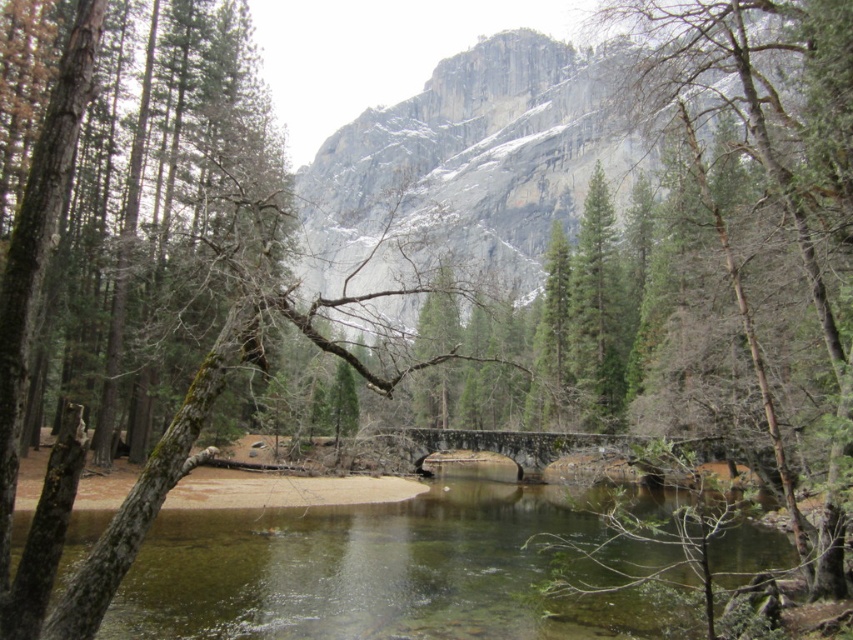
Question: Which point appears closest to the camera in this image?

Choices:
 (A) (315, 340)
 (B) (506, 508)
 (C) (461, 445)

Answer: (A)

Question: Based on their relative distances, which object is nearer to the green matte tree at center?

Choices:
 (A) gray rock mountain at upper center
 (B) green mossy tree trunk at center
 (C) clear water at center

Answer: (B)

Question: Does stone bridge at center have a smaller size compared to green mossy tree trunk at center?

Choices:
 (A) no
 (B) yes

Answer: (B)

Question: Does clear water at center appear on the left side of green matte tree at center?

Choices:
 (A) yes
 (B) no

Answer: (A)

Question: Does green matte tree at center come behind green mossy tree trunk at center?

Choices:
 (A) yes
 (B) no

Answer: (A)

Question: Which is farther from the gray rock mountain at upper center?

Choices:
 (A) green mossy tree trunk at center
 (B) green matte tree at center

Answer: (A)